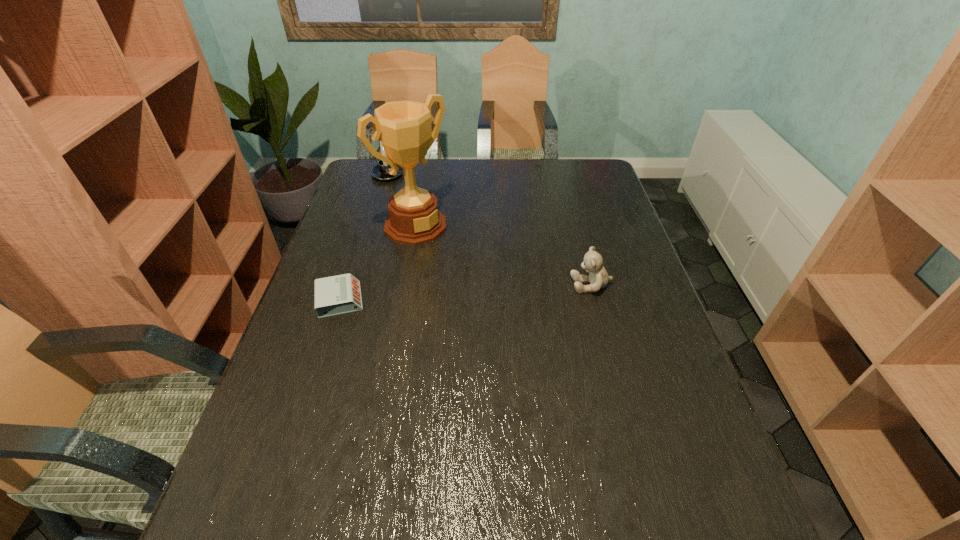
I want to click on the shortest object, so click(340, 294).

This screenshot has height=540, width=960. I want to click on teddy bear, so click(x=598, y=278).

The width and height of the screenshot is (960, 540). Find the location of `the third tallest object`. the third tallest object is located at coordinates (598, 278).

The width and height of the screenshot is (960, 540). I want to click on the farthest object, so click(380, 172).

Identify the location of candle holder. (380, 172).

This screenshot has width=960, height=540. Identify the location of award. click(404, 127).

Find the location of a particular element. The width and height of the screenshot is (960, 540). the tallest object is located at coordinates (404, 127).

The height and width of the screenshot is (540, 960). Identify the location of vacant space situated 0.270m on the right of the alarm clock. (468, 300).

At what (x,y) coordinates should I click in order to perform the action: click on free space located on the face of the second shortest object. Please return your answer as a coordinate pair (x, y). The width and height of the screenshot is (960, 540). Looking at the image, I should click on (509, 285).

You are a GUI agent. You are given a task and a screenshot of the screen. Output one action in this format:
    pyautogui.click(x=<x>, y=<y>)
    Task: Click on the blank area located 0.320m on the face of the second shortest object
    Image resolution: width=960 pixels, height=540 pixels.
    Given the screenshot: What is the action you would take?
    pyautogui.click(x=454, y=285)